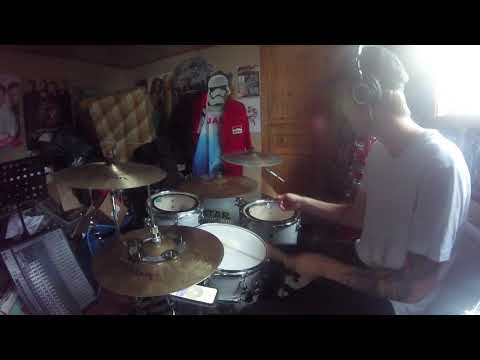
At what (x,y) coordinates should I click in order to perform the action: click on chair. Please return your answer as a coordinate pair (x, y). This screenshot has width=480, height=360. Looking at the image, I should click on (471, 265).